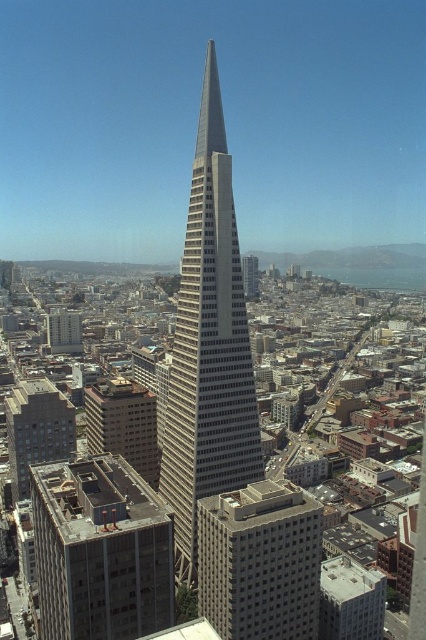
Question: Can you confirm if gray concrete skyscraper at center is positioned to the left of brown concrete building at lower left?

Choices:
 (A) yes
 (B) no

Answer: (B)

Question: Does gray concrete building at lower left come behind brown concrete building at lower left?

Choices:
 (A) no
 (B) yes

Answer: (A)

Question: Which object appears farthest from the camera in this image?

Choices:
 (A) gray concrete skyscraper at center
 (B) gray concrete building at lower left
 (C) concrete building at lower left

Answer: (B)

Question: Which of these objects is positioned closest to the gray concrete building at lower left?

Choices:
 (A) gray concrete skyscraper at center
 (B) brown concrete building at lower left

Answer: (B)

Question: Among these points, which one is nearest to the camera?

Choices:
 (A) (141, 388)
 (B) (210, 400)
 (C) (89, 532)
 (D) (287, 589)

Answer: (C)

Question: Is concrete building at lower left further to camera compared to gray concrete building at lower left?

Choices:
 (A) no
 (B) yes

Answer: (A)